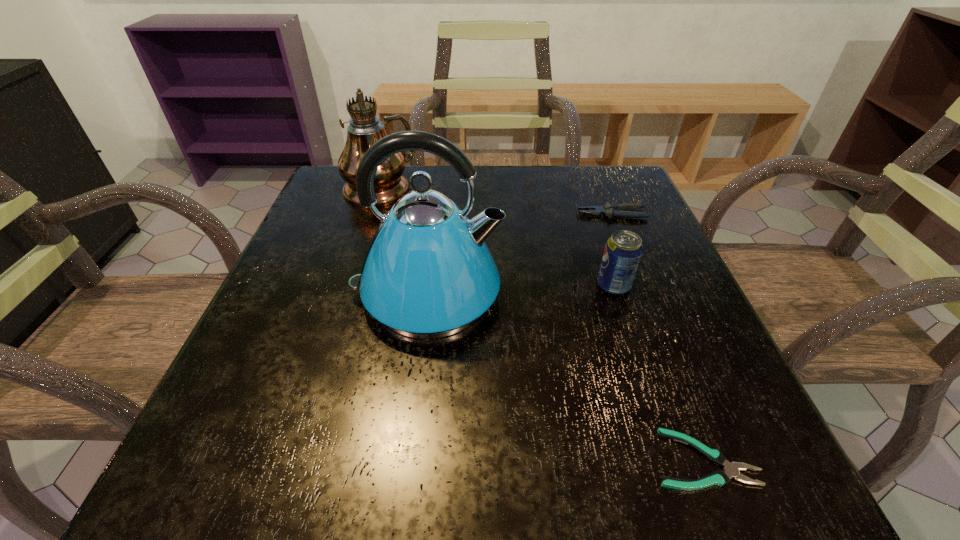
The image size is (960, 540). Identify the location of unoccupied area between the taller pliers and the oil lamp. (496, 201).

Identify the location of free space between the shorter pliers and the tallest object. (541, 323).

Where is `free space between the shortest object and the farther pliers`? The width and height of the screenshot is (960, 540). free space between the shortest object and the farther pliers is located at coordinates (658, 336).

Image resolution: width=960 pixels, height=540 pixels. I want to click on free space between the farther pliers and the oil lamp, so click(x=496, y=201).

Locate an element on the screen. This screenshot has width=960, height=540. vacant space that is in between the oil lamp and the second shortest object is located at coordinates (496, 201).

Locate an element on the screen. This screenshot has width=960, height=540. free spot between the oil lamp and the shortest object is located at coordinates (541, 323).

Locate an element on the screen. empty space that is in between the taller pliers and the tallest object is located at coordinates (496, 201).

This screenshot has height=540, width=960. I want to click on free space between the shortest object and the third tallest object, so click(659, 373).

Where is `free space between the shorter pliers and the fourth tallest object`? free space between the shorter pliers and the fourth tallest object is located at coordinates (658, 336).

Where is `object that is the closest one to the tallest object`? The width and height of the screenshot is (960, 540). object that is the closest one to the tallest object is located at coordinates (428, 273).